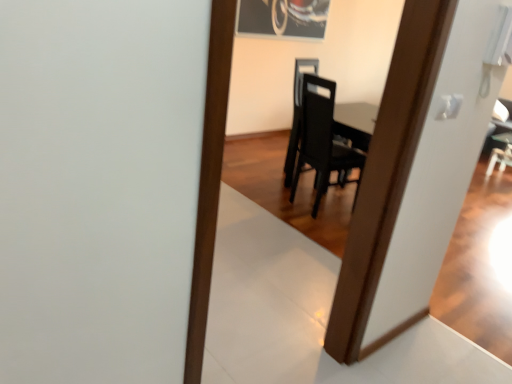
Question: Is metallic silver picture frame at upper center situated inside black matte chair at center or outside?

Choices:
 (A) inside
 (B) outside

Answer: (B)

Question: Visually, is metallic silver picture frame at upper center positioned to the left or to the right of black matte chair at center?

Choices:
 (A) right
 (B) left

Answer: (B)

Question: Is metallic silver picture frame at upper center in front of or behind black matte chair at center in the image?

Choices:
 (A) behind
 (B) front

Answer: (A)

Question: Is black matte chair at center bigger or smaller than metallic silver picture frame at upper center?

Choices:
 (A) big
 (B) small

Answer: (A)

Question: In the image, is black matte chair at center positioned in front of or behind metallic silver picture frame at upper center?

Choices:
 (A) behind
 (B) front

Answer: (B)

Question: Is black matte chair at center situated inside metallic silver picture frame at upper center or outside?

Choices:
 (A) inside
 (B) outside

Answer: (B)

Question: From their relative heights in the image, would you say black matte chair at center is taller or shorter than metallic silver picture frame at upper center?

Choices:
 (A) tall
 (B) short

Answer: (A)